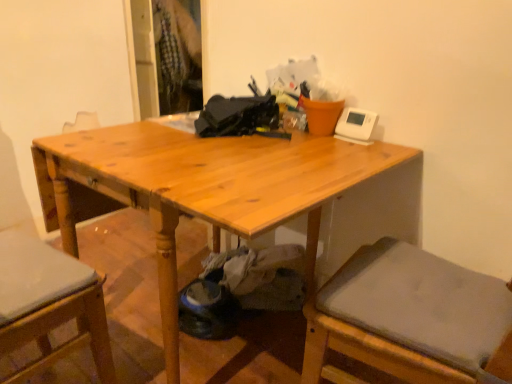
What do you see at coordinates (198, 188) in the screenshot? I see `light brown wood table at center` at bounding box center [198, 188].

I want to click on light brown wood table at center, so click(x=198, y=188).

I want to click on wooden chair at left, so click(x=49, y=303).

What do you see at coordinates (49, 303) in the screenshot? Image resolution: width=512 pixels, height=384 pixels. I see `wooden chair at left` at bounding box center [49, 303].

At what (x,y) coordinates should I click in order to perform the action: click on light brown wood table at center. Please return your answer as a coordinate pair (x, y). This screenshot has height=384, width=512. Looking at the image, I should click on (198, 188).

Is wooden chair at left at the right side of light brown wood table at center?

Incorrect, wooden chair at left is not on the right side of light brown wood table at center.

In the image, is wooden chair at left positioned in front of or behind light brown wood table at center?

Clearly, wooden chair at left is in front of light brown wood table at center.

Is point (17, 334) farther from viewer compared to point (157, 175)?

Yes.

From the image's perspective, is wooden chair at left beneath light brown wood table at center?

Yes, from the image's perspective, wooden chair at left is below light brown wood table at center.

From a real-world perspective, which is physically below, wooden chair at left or light brown wood table at center?

light brown wood table at center, from a real-world perspective.

Is wooden chair at left wider or thinner than light brown wood table at center?

In the image, wooden chair at left appears to be more narrow than light brown wood table at center.

Does wooden chair at left have a lesser height compared to light brown wood table at center?

In fact, wooden chair at left may be taller than light brown wood table at center.

Looking at this image, considering the relative sizes of wooden chair at left and light brown wood table at center in the image provided, is wooden chair at left smaller than light brown wood table at center?

Yes.

Is wooden chair at left inside the boundaries of light brown wood table at center, or outside?

wooden chair at left is not enclosed by light brown wood table at center.

Is wooden chair at left not close to light brown wood table at center?

wooden chair at left is actually quite close to light brown wood table at center.

Is wooden chair at left oriented towards light brown wood table at center?

Yes, wooden chair at left faces towards light brown wood table at center.

Can you tell me how much wooden chair at left and light brown wood table at center differ in facing direction?

wooden chair at left and light brown wood table at center are facing 173 degrees away from each other.

At what (x,y) coordinates should I click in order to perform the action: click on chair on the left of light brown wood table at center. Please return your answer as a coordinate pair (x, y). Looking at the image, I should click on (49, 303).

From the picture: Is light brown wood table at center at the right side of wooden chair at left?

Yes, light brown wood table at center is to the right of wooden chair at left.

Is light brown wood table at center positioned behind wooden chair at left?

Yes, light brown wood table at center is further from the camera.

Is point (262, 173) in front of point (66, 276)?

Yes, point (262, 173) is in front of point (66, 276).

From the image's perspective, between light brown wood table at center and wooden chair at left, who is located below?

wooden chair at left appears lower in the image.

From a real-world perspective, which is physically above, light brown wood table at center or wooden chair at left?

wooden chair at left is physically above.

Which object is thinner, light brown wood table at center or wooden chair at left?

Thinner between the two is wooden chair at left.

Looking at this image, considering the relative sizes of light brown wood table at center and wooden chair at left in the image provided, is light brown wood table at center shorter than wooden chair at left?

Correct, light brown wood table at center is not as tall as wooden chair at left.

Considering the sizes of objects light brown wood table at center and wooden chair at left in the image provided, who is bigger, light brown wood table at center or wooden chair at left?

Bigger between the two is light brown wood table at center.

Looking at this image, is light brown wood table at center not inside wooden chair at left?

Yes, light brown wood table at center is located beyond the bounds of wooden chair at left.

Would you consider light brown wood table at center to be distant from wooden chair at left?

That's not correct — light brown wood table at center is a little close to wooden chair at left.

Is light brown wood table at center turned away from wooden chair at left?

No.

Find the location of a particular element. table below the wooden chair at left (from a real-world perspective) is located at coordinates (198, 188).

Locate an element on the screen. This screenshot has height=384, width=512. table behind the wooden chair at left is located at coordinates (198, 188).

Where is `table below the wooden chair at left (from a real-world perspective)`? This screenshot has height=384, width=512. table below the wooden chair at left (from a real-world perspective) is located at coordinates (198, 188).